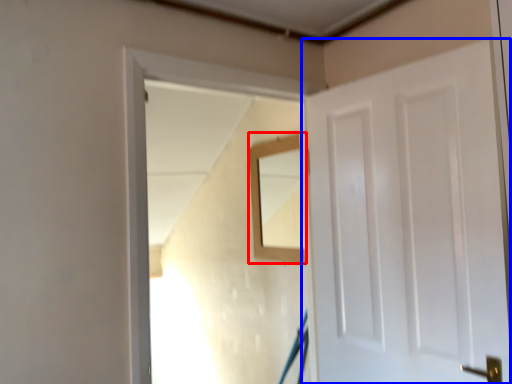
Question: Among these objects, which one is nearest to the camera, mirror (highlighted by a red box) or door (highlighted by a blue box)?

Choices:
 (A) mirror
 (B) door

Answer: (B)